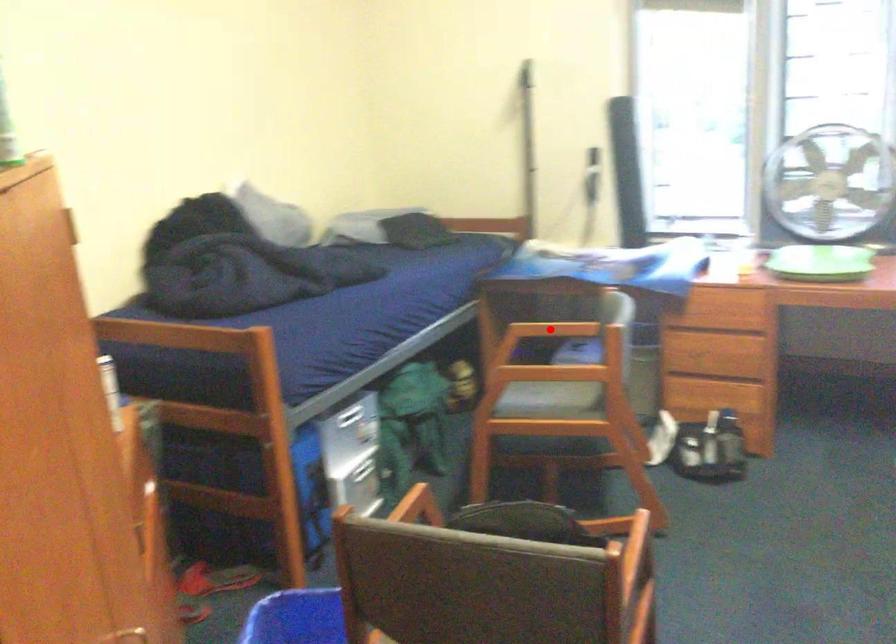
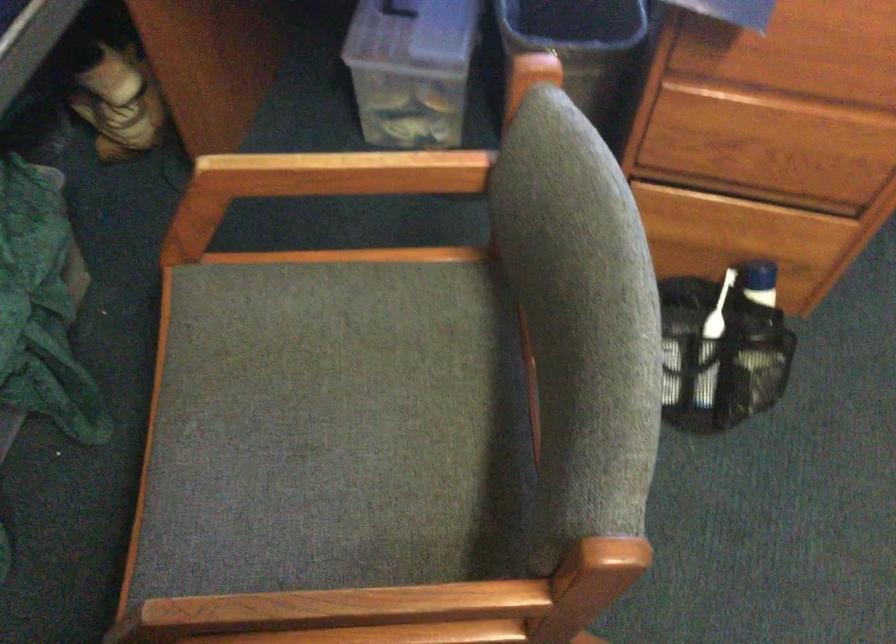
Question: I am providing you with two images of the same scene from different viewpoints. Image1 has a red point marked. In image2, the corresponding 3D location appears at what relative position? Reply with the corresponding letter.

Choices:
 (A) Closer
 (B) Farther

Answer: (A)